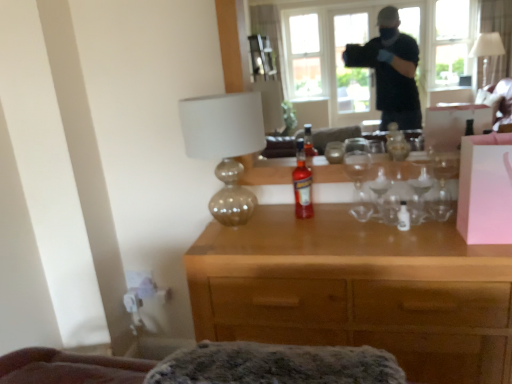
Locate an element on the screen. vacant space in between matte gold lamp at center and pink matte box at right is located at coordinates (355, 236).